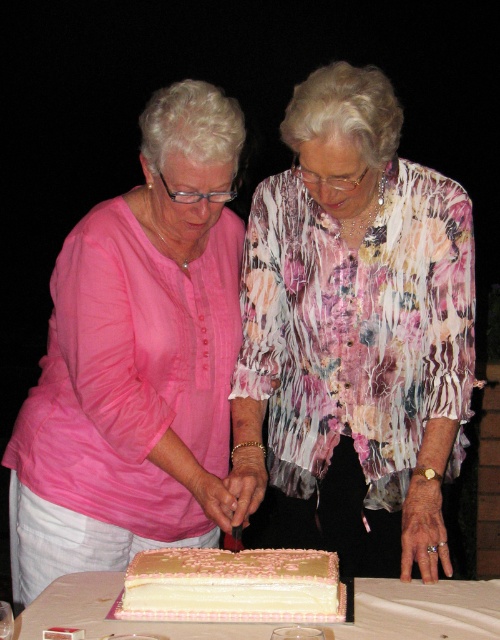
Question: Can you confirm if pink fabric shirt at left is thinner than white glossy cake at center?

Choices:
 (A) yes
 (B) no

Answer: (A)

Question: Does white glossy cake at center lie behind white cream cake at center?

Choices:
 (A) yes
 (B) no

Answer: (B)

Question: In this image, where is pink fabric shirt at left located relative to white glossy cake at center?

Choices:
 (A) below
 (B) above

Answer: (B)

Question: Which object is closer to the camera taking this photo?

Choices:
 (A) white glossy cake at center
 (B) pink fabric shirt at left
 (C) white cream cake at center

Answer: (A)

Question: Which point is closer to the camera taking this photo?

Choices:
 (A) (87, 612)
 (B) (102, 349)
 (C) (247, 582)

Answer: (C)

Question: Among these points, which one is nearest to the camera?

Choices:
 (A) (117, 509)
 (B) (275, 572)

Answer: (B)